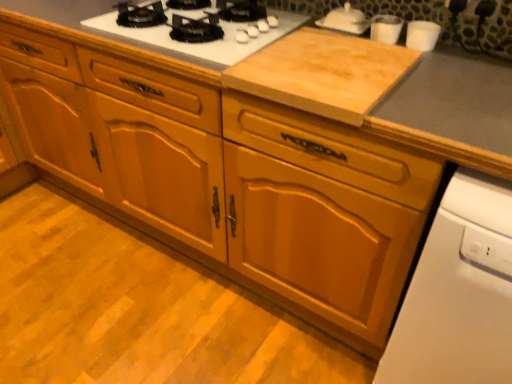
Find the location of a particular element. free space in front of white glossy teapot at upper right, arranged as the third appliance when viewed from the right is located at coordinates (343, 43).